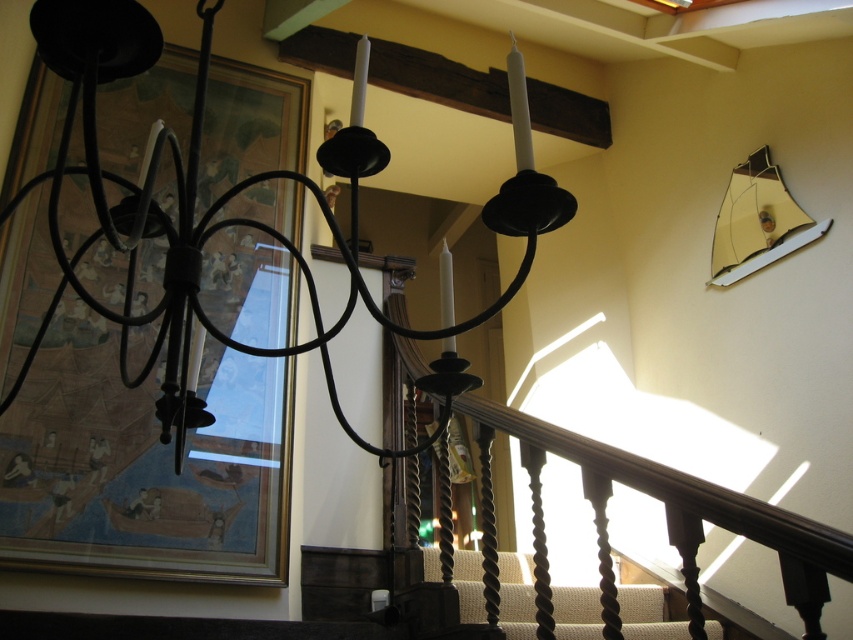
You are hanging a new decorative item in the hallway and want to place it to the right of the wooden framed picture at upper left and to the left of the matte black chandelier at upper center. Is there enough space between them to fit your item?

The wooden framed picture at upper left is positioned on the left side of matte black chandelier at upper center, so there is space between them to place your decorative item.

You are a painter who needs to hang a new painting that is 1.2 meters wide. You have two options to place it in the scene described. The first option is to place it where the matte black chandelier at upper center currently hangs. The second option is to place it where the dark wood stair at center is located. Based on the width of the objects, which location would be more suitable for your painting?

The matte black chandelier at upper center might be wider than the dark wood stair at center, so placing the 1.2 meters wide painting where the matte black chandelier at upper center is located would be more suitable if the chandelier is indeed wider. However, since the width comparison is uncertain, it is advisable to confirm the exact measurements before deciding.